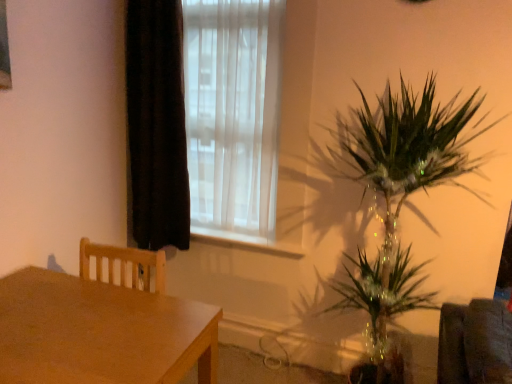
Question: Considering the relative positions of white sheer curtain at upper center and black velvet curtain at left in the image provided, is white sheer curtain at upper center in front of black velvet curtain at left?

Choices:
 (A) no
 (B) yes

Answer: (B)

Question: Is white sheer curtain at upper center thinner than black velvet curtain at left?

Choices:
 (A) yes
 (B) no

Answer: (A)

Question: Is white sheer curtain at upper center positioned behind black velvet curtain at left?

Choices:
 (A) yes
 (B) no

Answer: (B)

Question: Is black velvet curtain at left surrounded by white sheer curtain at upper center?

Choices:
 (A) no
 (B) yes

Answer: (B)

Question: Is white sheer curtain at upper center to the right of black velvet curtain at left from the viewer's perspective?

Choices:
 (A) no
 (B) yes

Answer: (B)

Question: Is white sheer curtain at upper center in front of or behind wooden table at left in the image?

Choices:
 (A) front
 (B) behind

Answer: (B)

Question: Based on their positions, is white sheer curtain at upper center located to the left or right of wooden table at left?

Choices:
 (A) right
 (B) left

Answer: (A)

Question: Is point (242, 145) positioned closer to the camera than point (117, 365)?

Choices:
 (A) farther
 (B) closer

Answer: (A)

Question: From their relative heights in the image, would you say white sheer curtain at upper center is taller or shorter than wooden table at left?

Choices:
 (A) tall
 (B) short

Answer: (A)

Question: From the image's perspective, is wooden table at left located above or below white sheer curtain at upper center?

Choices:
 (A) below
 (B) above

Answer: (A)

Question: From a real-world perspective, relative to white sheer curtain at upper center, is wooden table at left vertically above or below?

Choices:
 (A) above
 (B) below

Answer: (B)

Question: Relative to white sheer curtain at upper center, is wooden table at left in front or behind?

Choices:
 (A) behind
 (B) front

Answer: (B)

Question: Based on their positions, is wooden table at left located to the left or right of white sheer curtain at upper center?

Choices:
 (A) left
 (B) right

Answer: (A)

Question: Considering the positions of white sheer curtain at upper center and white plastic window sill at center in the image, is white sheer curtain at upper center wider or thinner than white plastic window sill at center?

Choices:
 (A) wide
 (B) thin

Answer: (A)

Question: Considering the relative positions of white sheer curtain at upper center and white plastic window sill at center in the image provided, is white sheer curtain at upper center to the left or to the right of white plastic window sill at center?

Choices:
 (A) right
 (B) left

Answer: (B)